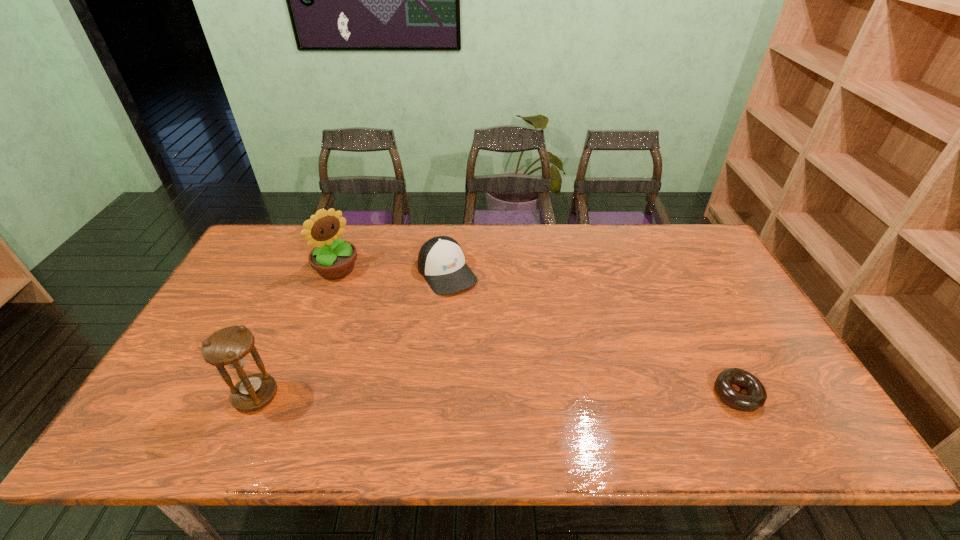
Locate an element on the screen. free spot between the hourglass and the second object from right to left is located at coordinates (351, 334).

This screenshot has height=540, width=960. Identify the location of free spot between the sunflower and the cap. (392, 271).

Find the location of a particular element. The height and width of the screenshot is (540, 960). unoccupied area between the cap and the sunflower is located at coordinates (392, 271).

Where is `vacant area between the third object from left to right and the doughnut`? The height and width of the screenshot is (540, 960). vacant area between the third object from left to right and the doughnut is located at coordinates (592, 334).

Find the location of a particular element. This screenshot has height=540, width=960. unoccupied position between the sunflower and the hourglass is located at coordinates (297, 332).

Find the location of `free space between the sunflower and the rightmost object`. free space between the sunflower and the rightmost object is located at coordinates (537, 332).

Select which object is the third closest to the sunflower. Please provide its 2D coordinates. Your answer should be formatted as a tuple, i.e. [(x, y)], where the tuple contains the x and y coordinates of a point satisfying the conditions above.

[(756, 396)]

Point out which object is positioned as the nearest to the hourglass. Please provide its 2D coordinates. Your answer should be formatted as a tuple, i.e. [(x, y)], where the tuple contains the x and y coordinates of a point satisfying the conditions above.

[(332, 258)]

Where is `free space that satisfies the following two spatial constraints: 1. on the front side of the sunflower; 2. on the left side of the second shortest object`? free space that satisfies the following two spatial constraints: 1. on the front side of the sunflower; 2. on the left side of the second shortest object is located at coordinates (335, 273).

Image resolution: width=960 pixels, height=540 pixels. I want to click on blank area in the image that satisfies the following two spatial constraints: 1. on the back side of the sunflower; 2. on the left side of the hourglass, so click(312, 268).